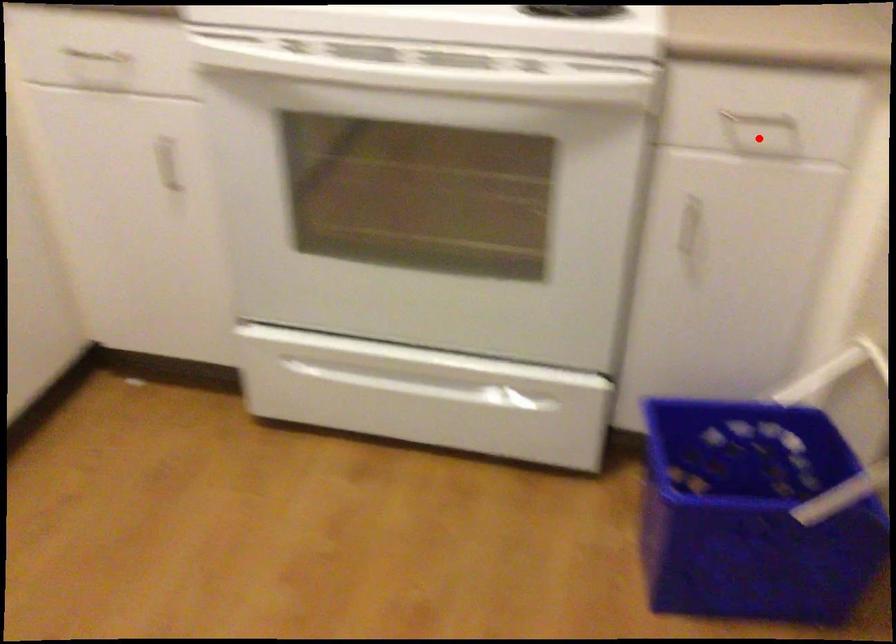
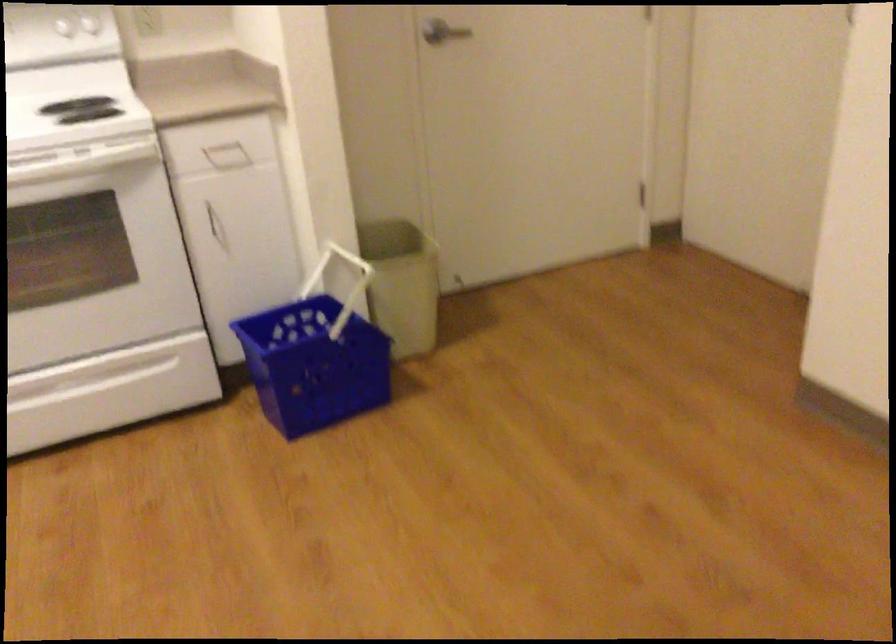
Find the pixel in the second image that matches the highlighted location in the first image.

(227, 156)